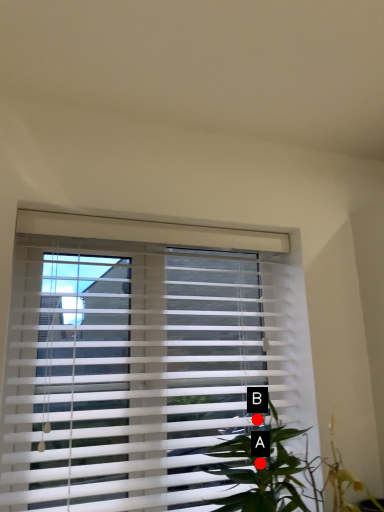
Question: Two points are circled on the image, labeled by A and B beside each circle. Which point is closer to the camera?

Choices:
 (A) A is closer
 (B) B is closer

Answer: (A)